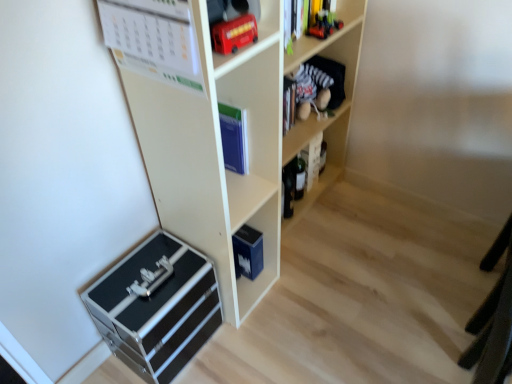
This screenshot has height=384, width=512. I want to click on vacant area on top of black metallic toolbox at lower left, which appears as the 4th shelf when viewed from the top (from a real-world perspective), so (x=144, y=277).